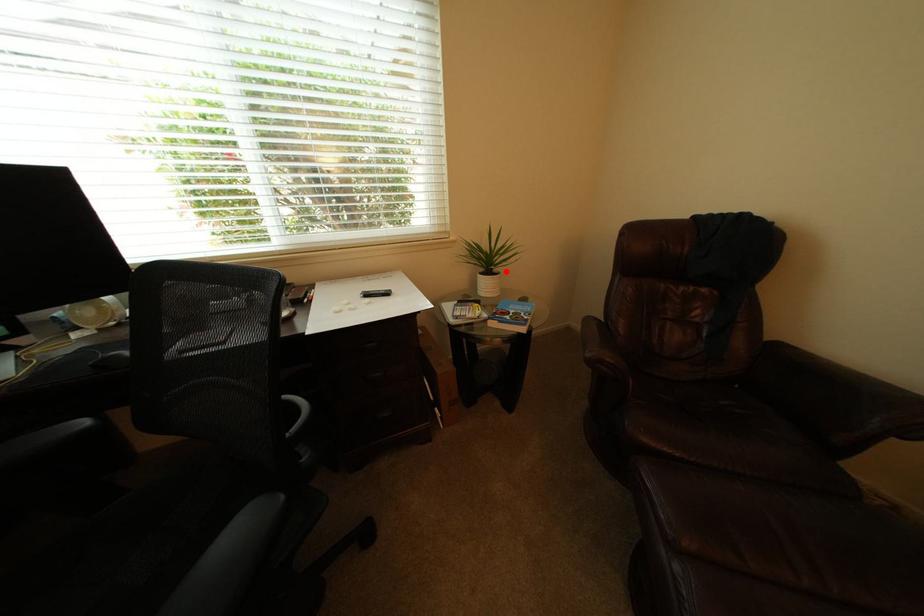
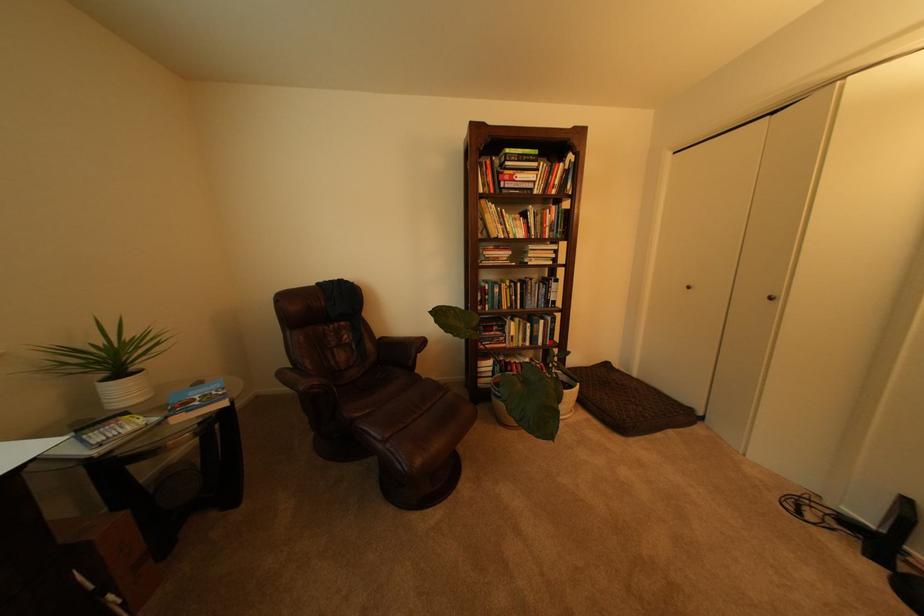
The point at the highlighted location is marked in the first image. Where is the corresponding point in the second image?

(143, 370)